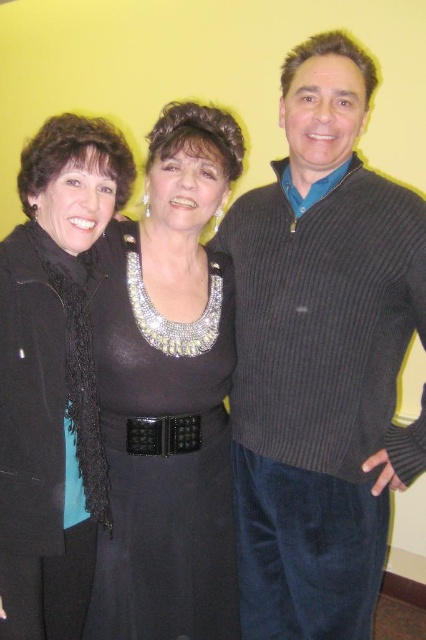
Can you confirm if ribbed sweater at center is positioned above black leather belt at center?

Yes, ribbed sweater at center is above black leather belt at center.

Who is higher up, ribbed sweater at center or black leather belt at center?

Positioned higher is ribbed sweater at center.

Who is more forward, (368, 259) or (169, 424)?

Point (368, 259)

Where is `ribbed sweater at center`? The width and height of the screenshot is (426, 640). ribbed sweater at center is located at coordinates (322, 356).

Is point (42, 275) less distant than point (140, 429)?

Yes, point (42, 275) is closer to viewer.

Does black matte scarf at left appear on the right side of black leather belt at center?

Incorrect, black matte scarf at left is not on the right side of black leather belt at center.

Identify the location of black matte scarf at left. The height and width of the screenshot is (640, 426). (52, 376).

You are a GUI agent. You are given a task and a screenshot of the screen. Output one action in this format:
    pyautogui.click(x=<x>, y=<y>)
    Task: Click on the black matte scarf at left
    The image size is (426, 640).
    Given the screenshot: What is the action you would take?
    pyautogui.click(x=52, y=376)

Is black satin dress at center taller than black leather belt at center?

Yes, black satin dress at center is taller than black leather belt at center.

Does black satin dress at center have a greater width compared to black leather belt at center?

Yes.

Between point (186, 408) and point (164, 456), which one is positioned behind?

The point (186, 408) is more distant.

Locate an element on the screen. Image resolution: width=426 pixels, height=640 pixels. black satin dress at center is located at coordinates (167, 394).